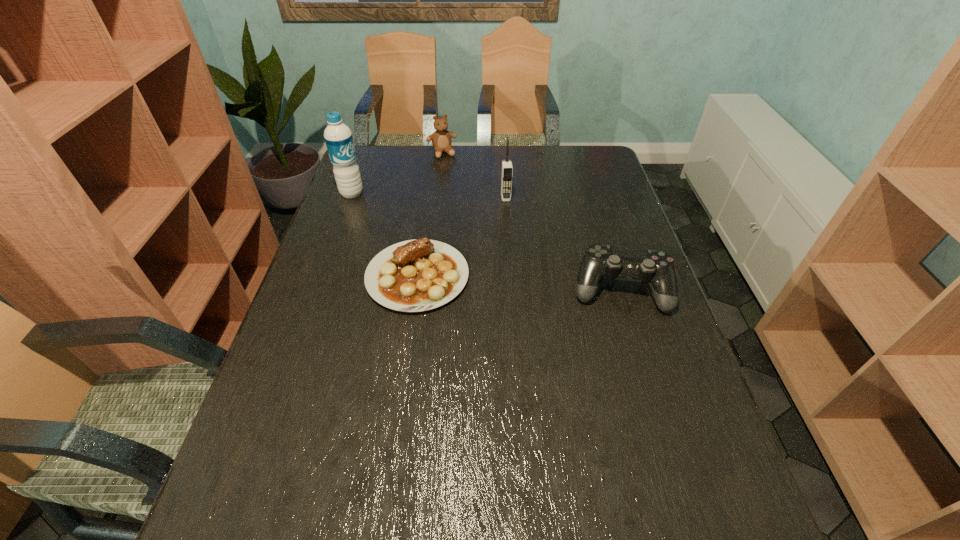
Locate an element on the screen. This screenshot has height=540, width=960. vacant space at the near right corner of the desktop is located at coordinates (644, 444).

At what (x,y) coordinates should I click in order to perform the action: click on free space between the water bottle and the third tallest object. Please return your answer as a coordinate pair (x, y). Looking at the image, I should click on (396, 173).

The height and width of the screenshot is (540, 960). Identify the location of vacant space that is in between the rightmost object and the teddy bear. (531, 221).

Image resolution: width=960 pixels, height=540 pixels. I want to click on free space between the teddy bear and the rightmost object, so click(x=531, y=221).

The width and height of the screenshot is (960, 540). I want to click on vacant space that is in between the rightmost object and the third shortest object, so click(x=531, y=221).

Identify the location of empty location between the water bottle and the farthest object. (396, 173).

Locate an element on the screen. This screenshot has width=960, height=540. empty space that is in between the shortest object and the rightmost object is located at coordinates (519, 283).

Where is `free space between the shortest object and the third shortest object`? This screenshot has height=540, width=960. free space between the shortest object and the third shortest object is located at coordinates (430, 215).

I want to click on vacant area between the teddy bear and the fourth tallest object, so click(x=531, y=221).

Locate an element on the screen. The height and width of the screenshot is (540, 960). free space that is in between the teddy bear and the steak is located at coordinates (430, 215).